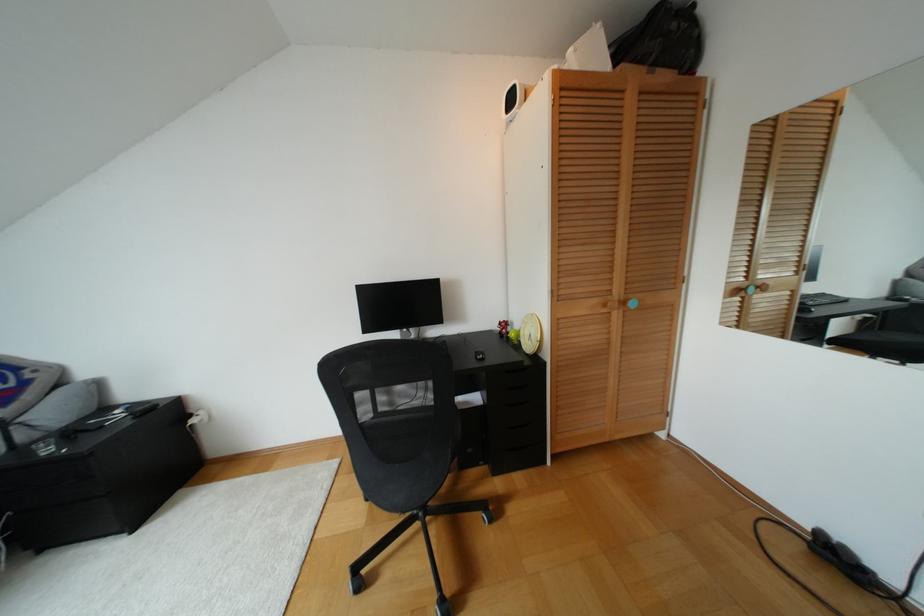
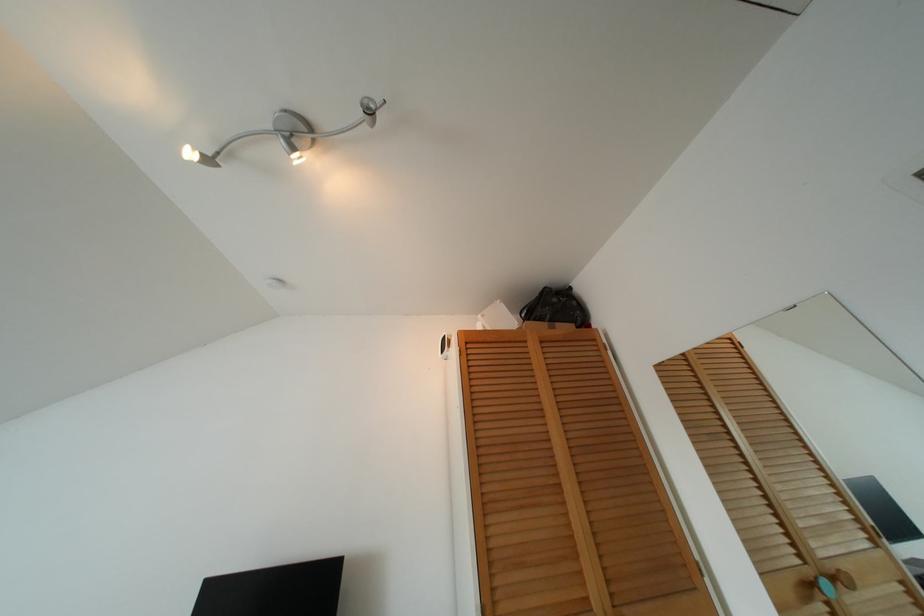
In the second image, find the point that corresponds to point (640, 60) in the first image.

(541, 318)